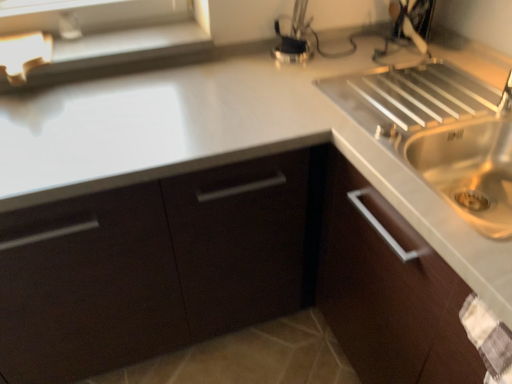
Find the location of a particular element. The height and width of the screenshot is (384, 512). matte dark brown cabinet at center is located at coordinates (226, 273).

This screenshot has width=512, height=384. Describe the element at coordinates (226, 273) in the screenshot. I see `matte dark brown cabinet at center` at that location.

Describe the element at coordinates (113, 35) in the screenshot. The image size is (512, 384). I see `matte white window sill at upper left` at that location.

The image size is (512, 384). Find the location of `matte white window sill at upper left`. matte white window sill at upper left is located at coordinates (113, 35).

The height and width of the screenshot is (384, 512). Find the location of `matte dark brown cabinet at center`. matte dark brown cabinet at center is located at coordinates (226, 273).

Considering the relative positions of matte white window sill at upper left and matte dark brown cabinet at center in the image provided, is matte white window sill at upper left to the right of matte dark brown cabinet at center from the viewer's perspective?

No.

In the image, is matte white window sill at upper left positioned in front of or behind matte dark brown cabinet at center?

Visually, matte white window sill at upper left is located behind matte dark brown cabinet at center.

Does point (59, 78) appear closer or farther from the camera than point (182, 283)?

Clearly, point (59, 78) is more distant from the camera than point (182, 283).

From the image's perspective, is matte white window sill at upper left located above or below matte dark brown cabinet at center?

Based on their image positions, matte white window sill at upper left is located above matte dark brown cabinet at center.

From a real-world perspective, which object rests below the other?

matte dark brown cabinet at center is physically lower.

Considering the relative sizes of matte white window sill at upper left and matte dark brown cabinet at center in the image provided, is matte white window sill at upper left thinner than matte dark brown cabinet at center?

Correct, the width of matte white window sill at upper left is less than that of matte dark brown cabinet at center.

Who is shorter, matte white window sill at upper left or matte dark brown cabinet at center?

Standing shorter between the two is matte white window sill at upper left.

Considering the relative sizes of matte white window sill at upper left and matte dark brown cabinet at center in the image provided, is matte white window sill at upper left smaller than matte dark brown cabinet at center?

Yes, matte white window sill at upper left is smaller than matte dark brown cabinet at center.

Does matte white window sill at upper left contain matte dark brown cabinet at center?

No, matte white window sill at upper left does not contain matte dark brown cabinet at center.

Is matte white window sill at upper left not close to matte dark brown cabinet at center?

They are positioned close to each other.

Does matte white window sill at upper left turn towards matte dark brown cabinet at center?

No, matte white window sill at upper left is not facing towards matte dark brown cabinet at center.

Can you tell me how much matte white window sill at upper left and matte dark brown cabinet at center differ in facing direction?

matte white window sill at upper left and matte dark brown cabinet at center are facing 7.6e-05 degrees away from each other.

Locate an element on the screen. window sill that is above the matte dark brown cabinet at center (from a real-world perspective) is located at coordinates (113, 35).

In the image, is matte dark brown cabinet at center on the left side or the right side of matte white window sill at upper left?

Clearly, matte dark brown cabinet at center is on the right of matte white window sill at upper left in the image.

Is the depth of matte dark brown cabinet at center less than that of matte white window sill at upper left?

Yes.

Is point (422, 347) closer or farther from the camera than point (91, 32)?

Clearly, point (422, 347) is closer to the camera than point (91, 32).

From the image's perspective, is matte dark brown cabinet at center located above or below matte white window sill at upper left?

From the image's perspective, matte dark brown cabinet at center appears below matte white window sill at upper left.

From a real-world perspective, is matte dark brown cabinet at center physically above matte white window sill at upper left?

Incorrect, from a real-world perspective, matte dark brown cabinet at center is lower than matte white window sill at upper left.

Between matte dark brown cabinet at center and matte white window sill at upper left, which one has larger width?

Wider between the two is matte dark brown cabinet at center.

From the picture: Considering the sizes of matte dark brown cabinet at center and matte white window sill at upper left in the image, is matte dark brown cabinet at center taller or shorter than matte white window sill at upper left?

In the image, matte dark brown cabinet at center appears to be taller than matte white window sill at upper left.

Based on their sizes in the image, would you say matte dark brown cabinet at center is bigger or smaller than matte white window sill at upper left?

Considering their sizes, matte dark brown cabinet at center takes up more space than matte white window sill at upper left.

Is matte white window sill at upper left completely or partially inside matte dark brown cabinet at center?

No, matte white window sill at upper left is located outside of matte dark brown cabinet at center.

Would you consider matte dark brown cabinet at center to be distant from matte white window sill at upper left?

That's not correct — matte dark brown cabinet at center is a little close to matte white window sill at upper left.

Is matte dark brown cabinet at center aimed at matte white window sill at upper left?

No.

What's the angular difference between matte dark brown cabinet at center and matte white window sill at upper left's facing directions?

The facing directions of matte dark brown cabinet at center and matte white window sill at upper left are 7.6e-05 degrees apart.

In the image, there is a matte dark brown cabinet at center. At what (x,y) coordinates should I click in order to perform the action: click on window sill above it (from the image's perspective). Please return your answer as a coordinate pair (x, y). Looking at the image, I should click on (113, 35).

This screenshot has width=512, height=384. There is a matte dark brown cabinet at center. What are the coordinates of `window sill above it (from a real-world perspective)` in the screenshot? It's located at (113, 35).

You are a GUI agent. You are given a task and a screenshot of the screen. Output one action in this format:
    pyautogui.click(x=<x>, y=<y>)
    Task: Click on the window sill lying above the matte dark brown cabinet at center (from the image's perspective)
    
    Given the screenshot: What is the action you would take?
    pyautogui.click(x=113, y=35)